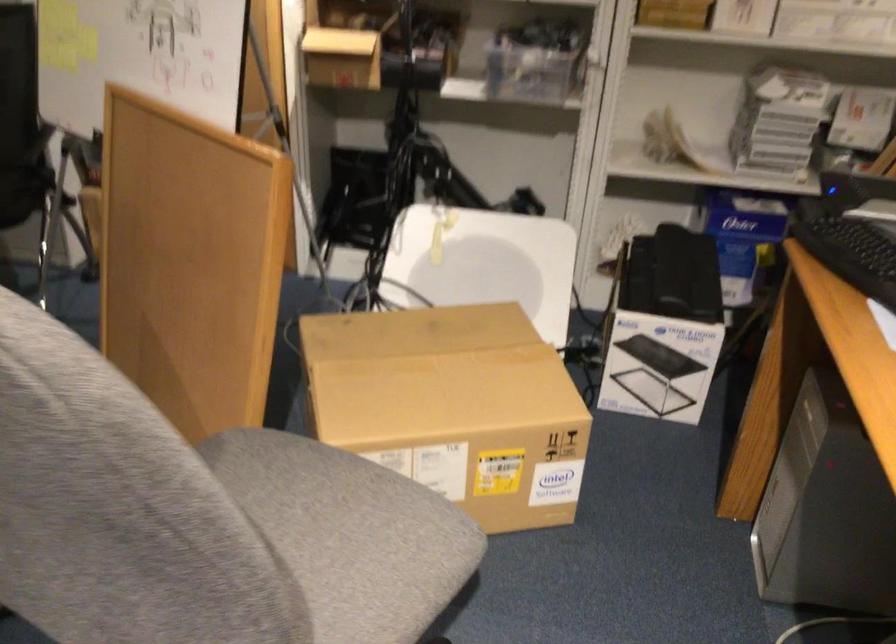
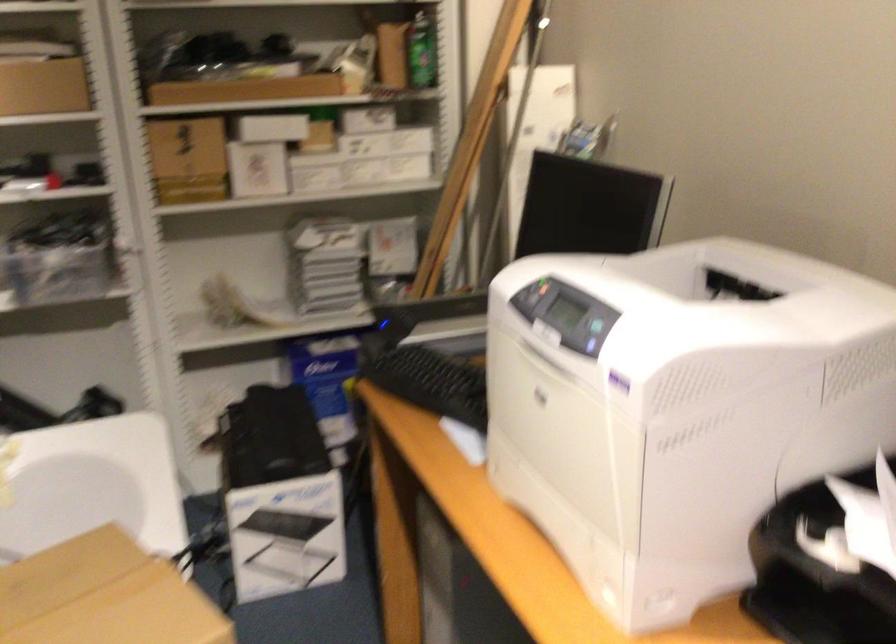
Question: The images are taken continuously from a first-person perspective. In which direction is your viewpoint rotating?

Choices:
 (A) Left
 (B) Right
 (C) Up
 (D) Down

Answer: (B)